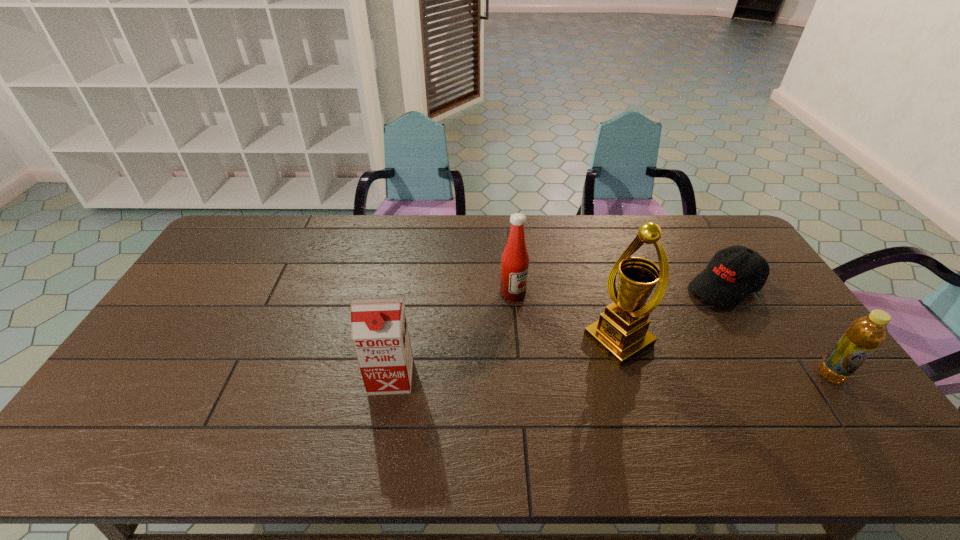
The width and height of the screenshot is (960, 540). I want to click on free space located on the front-facing side of the condiment, so click(547, 327).

This screenshot has height=540, width=960. I want to click on vacant space located 0.380m on the front-facing side of the baseball cap, so click(616, 355).

At what (x,y) coordinates should I click in order to perform the action: click on vacant space located on the front-facing side of the baseball cap. Please return your answer as a coordinate pair (x, y). Looking at the image, I should click on (659, 328).

Identify the location of free space located 0.110m on the front-facing side of the baseball cap. (678, 315).

At what (x,y) coordinates should I click in order to perform the action: click on vacant space located 0.280m on the front-facing side of the third object from left to right. Please return your answer as a coordinate pair (x, y). Looking at the image, I should click on (515, 404).

The image size is (960, 540). Identify the location of vacant area situated 0.120m on the front-facing side of the third object from left to right. (562, 375).

I want to click on blank space located on the front-facing side of the third object from left to right, so click(578, 365).

Where is `object that is at the near edge`? object that is at the near edge is located at coordinates (379, 330).

The width and height of the screenshot is (960, 540). Identify the location of bottle at the right edge. (865, 334).

In order to click on baseball cap at the right edge in this screenshot , I will do `click(733, 273)`.